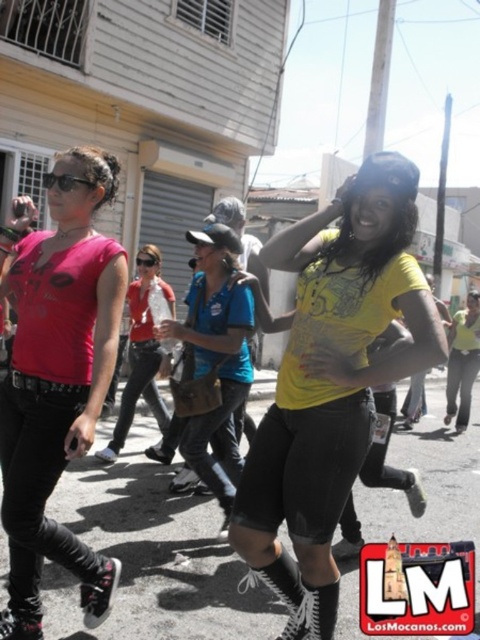
Does yellow matte shirt at center lie behind matte black shirt at center?

No, yellow matte shirt at center is closer to the viewer.

Does yellow matte shirt at center have a lesser height compared to matte black shirt at center?

No.

Which is behind, point (303, 314) or point (154, 397)?

Positioned behind is point (154, 397).

The width and height of the screenshot is (480, 640). Identify the location of yellow matte shirt at center. (332, 381).

Who is more forward, (x=26, y=566) or (x=195, y=420)?

Point (x=26, y=566) is in front.

This screenshot has height=640, width=480. What are the coordinates of `matte pink t-shirt at left` in the screenshot? It's located at (57, 378).

Is point (342, 228) closer to viewer compared to point (216, 288)?

That is True.

In the scene shown: Can you confirm if yellow matte shirt at center is shorter than blue denim shirt at center?

No, yellow matte shirt at center is not shorter than blue denim shirt at center.

Is point (348, 397) more distant than point (199, 442)?

That is False.

The image size is (480, 640). What are the coordinates of `yellow matte shirt at center` in the screenshot? It's located at (332, 381).